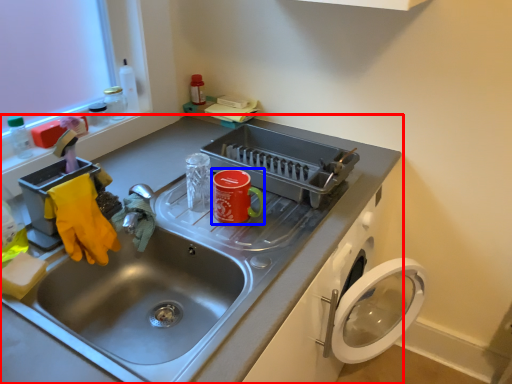
Question: Which object is further to the camera taking this photo, sink (highlighted by a red box) or appliance (highlighted by a blue box)?

Choices:
 (A) sink
 (B) appliance

Answer: (B)